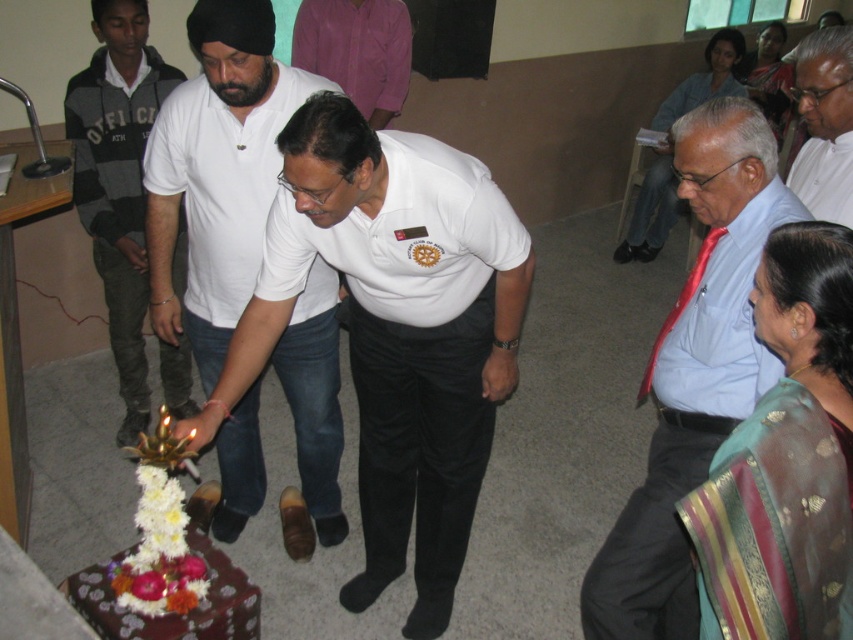
Question: Is white matte shirt at center below white shirt at center?

Choices:
 (A) yes
 (B) no

Answer: (A)

Question: Based on their relative distances, which object is nearer to the white cotton shirt at center?

Choices:
 (A) light blue shirt at center
 (B) pink shirt at upper center
 (C) white shirt at center

Answer: (A)

Question: Which point appears farthest from the camera in this image?

Choices:
 (A) (370, 349)
 (B) (757, 380)
 (C) (112, 49)

Answer: (C)

Question: Among these points, which one is nearest to the camera?

Choices:
 (A) (132, 150)
 (B) (338, 8)

Answer: (A)

Question: Is light blue shirt at center to the right of pink shirt at upper center from the viewer's perspective?

Choices:
 (A) yes
 (B) no

Answer: (A)

Question: In this image, where is white matte shirt at center located relative to light blue shirt at center?

Choices:
 (A) above
 (B) below

Answer: (A)